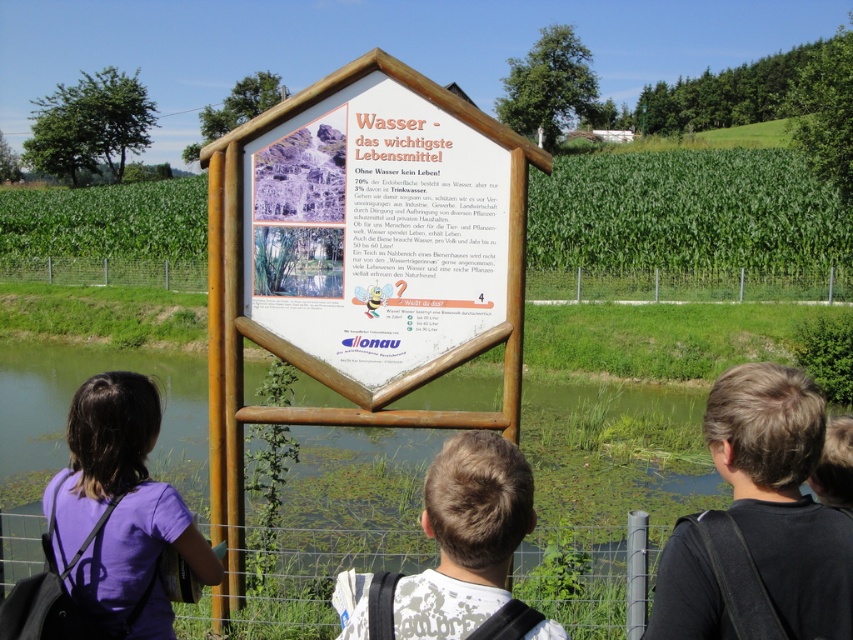
Question: Which point is farther from the camera taking this photo?

Choices:
 (A) (717, 280)
 (B) (718, 412)
 (C) (575, 272)

Answer: (C)

Question: Which of the following is the closest to the observer?

Choices:
 (A) brown hair at center
 (B) purple fabric shirt at lower left

Answer: (A)

Question: Is wooden sign at center behind wooden fence at center?

Choices:
 (A) yes
 (B) no

Answer: (B)

Question: Which of these objects is positioned farthest from the brown hair at center?

Choices:
 (A) green grass at center
 (B) wooden fence at center
 (C) green grassy pond at center
 (D) wooden sign at center

Answer: (A)

Question: Where is purple fabric shirt at lower left located in relation to wooden fence at center in the image?

Choices:
 (A) below
 (B) above

Answer: (A)

Question: In this image, where is green grass at center located relative to purple fabric shirt at lower left?

Choices:
 (A) right
 (B) left

Answer: (A)